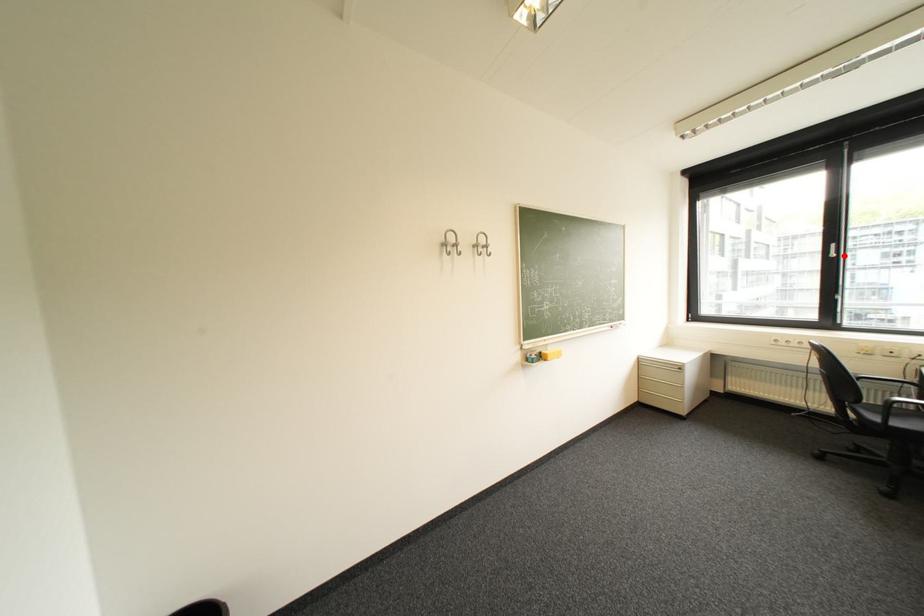
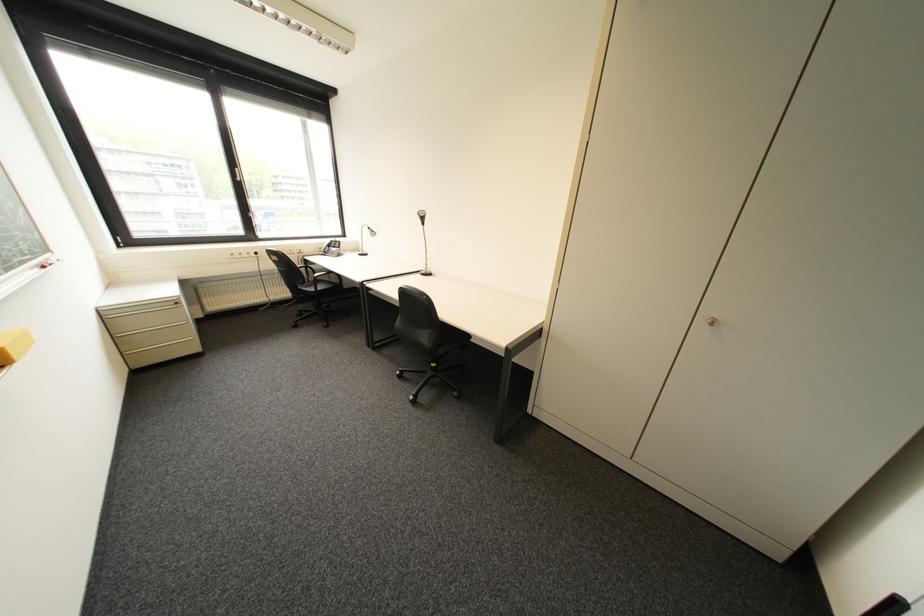
Question: I am providing you with two images of the same scene from different viewpoints. A red point is shown in image1. For the corresponding object point in image2, is it positioned nearer or farther from the camera?

Choices:
 (A) Nearer
 (B) Farther

Answer: (A)